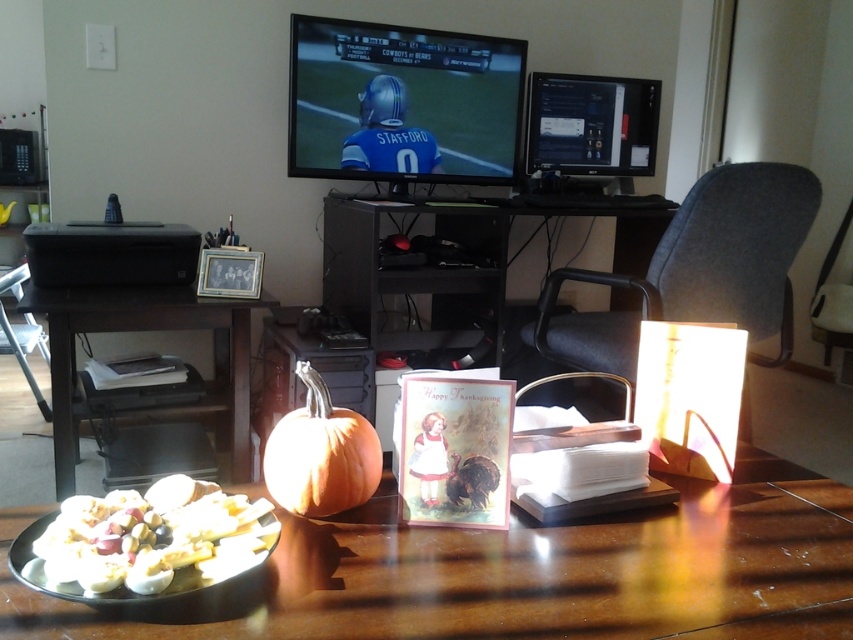
Based on the photo, you are a delivery person who needs to place a 30 inch box on the wooden table at center. Can the box fit on the table without overhanging the edges?

The wooden table at center has a length of 29.96 inches, so the 30 inch box would overhang slightly by 0.04 inches. It might not fit perfectly without some part of the box extending beyond the table edges.

You are standing in the living room and want to place a small figurine on the table. The table has two specific points marked at coordinates point (x=534, y=628) and point (x=141, y=307). If you want the figurine to be as close as possible to the camera, which point should you choose?

Point (x=534, y=628) is closer to the camera than point (x=141, y=307), so you should place the figurine there.